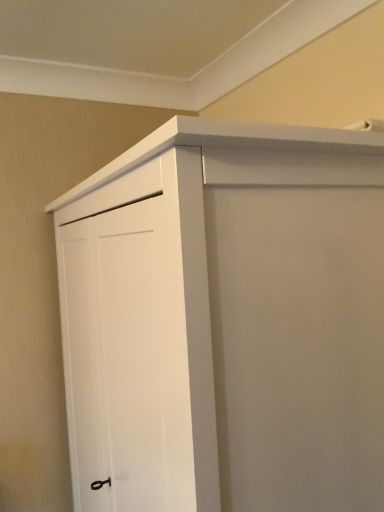
At what (x,y) coordinates should I click in order to perform the action: click on white glossy cupboard at center. Please return your answer as a coordinate pair (x, y). The width and height of the screenshot is (384, 512). Looking at the image, I should click on (226, 321).

Measure the distance between white glossy cupboard at center and camera.

They are 21.14 inches apart.

The image size is (384, 512). What do you see at coordinates (226, 321) in the screenshot?
I see `white glossy cupboard at center` at bounding box center [226, 321].

Locate an element on the screen. This screenshot has height=512, width=384. white glossy cupboard at center is located at coordinates (226, 321).